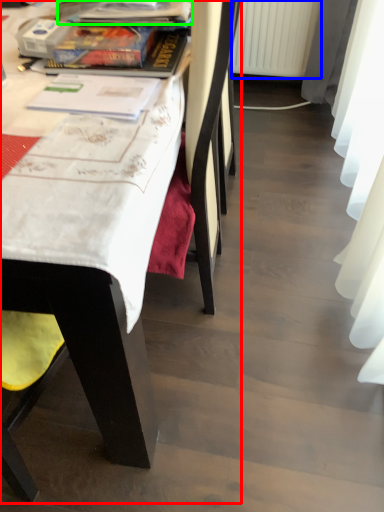
Question: Estimate the real-world distances between objects in this image. Which object is farther from chair (highlighted by a red box), radiator (highlighted by a blue box) or book (highlighted by a green box)?

Choices:
 (A) radiator
 (B) book

Answer: (A)